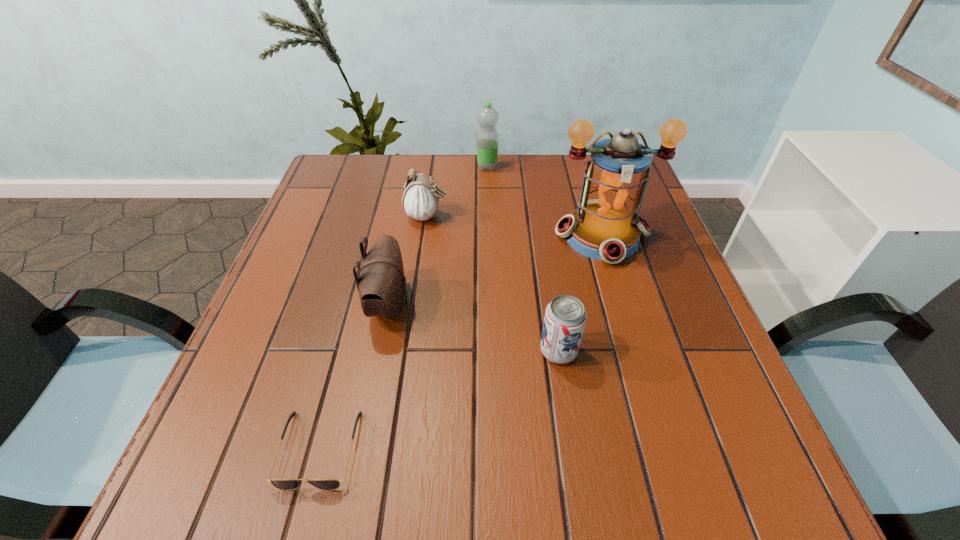
You are a GUI agent. You are given a task and a screenshot of the screen. Output one action in this format:
    pyautogui.click(x=<x>, y=<y>)
    Task: Click on the tallest object
    
    Given the screenshot: What is the action you would take?
    pyautogui.click(x=606, y=226)

At what (x,y) coordinates should I click in order to perform the action: click on the fourth object from left to right. Please return your answer as a coordinate pair (x, y). Looking at the image, I should click on (487, 138).

This screenshot has width=960, height=540. I want to click on water bottle, so click(x=487, y=138).

Identify the location of the nearer pouch. The height and width of the screenshot is (540, 960). (381, 283).

You are a GUI agent. You are given a task and a screenshot of the screen. Output one action in this format:
    pyautogui.click(x=<x>, y=<y>)
    Task: Click on the farther pouch
    This screenshot has width=960, height=540.
    Given the screenshot: What is the action you would take?
    pyautogui.click(x=420, y=201)

The image size is (960, 540). I want to click on beer can, so click(565, 317).

Locate an element on the screen. The height and width of the screenshot is (540, 960). the shortest object is located at coordinates (283, 484).

Identify the location of sunglasses. (283, 484).

Locate an element on the screen. The width and height of the screenshot is (960, 540). vacant space situated 0.390m on the front-facing side of the lantern is located at coordinates (663, 438).

Locate an element on the screen. This screenshot has width=960, height=540. vacant space situated on the front of the third object from right to left is located at coordinates (489, 235).